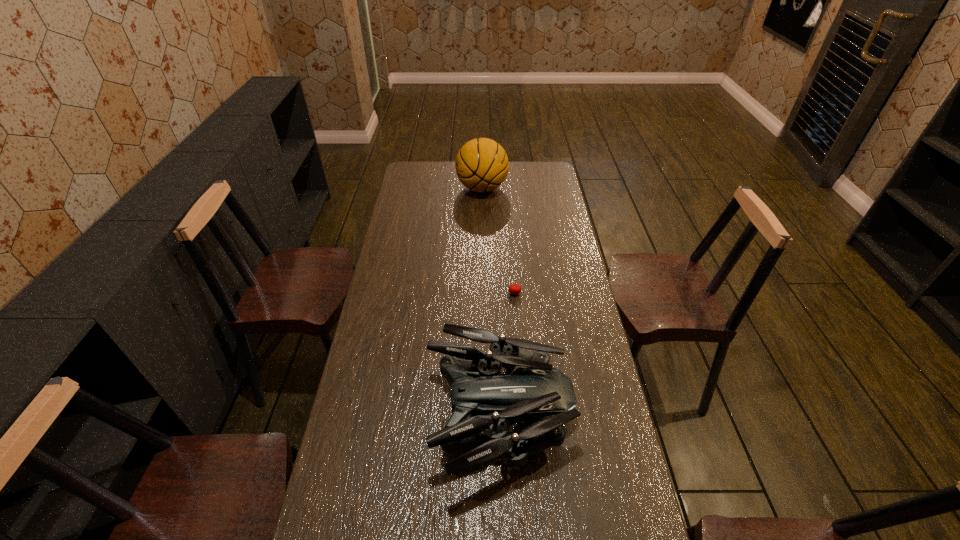
I want to click on vacant region between the drone and the farthest object, so click(x=491, y=302).

Find the location of `unoccupied position between the basketball and the second shortest object`. unoccupied position between the basketball and the second shortest object is located at coordinates (491, 302).

Locate an element on the screen. Image resolution: width=960 pixels, height=540 pixels. vacant space in between the second shortest object and the farthest object is located at coordinates (491, 302).

Locate an element on the screen. vacant area that lies between the farthest object and the cherry is located at coordinates (498, 241).

I want to click on free space between the farthest object and the cherry, so click(498, 241).

Point out which object is positioned as the second nearest to the basketball. Please provide its 2D coordinates. Your answer should be formatted as a tuple, i.e. [(x, y)], where the tuple contains the x and y coordinates of a point satisfying the conditions above.

[(482, 399)]

Where is `object identified as the second closest to the cherry`? This screenshot has height=540, width=960. object identified as the second closest to the cherry is located at coordinates (481, 164).

Locate an element on the screen. Image resolution: width=960 pixels, height=540 pixels. vacant space that satisfies the following two spatial constraints: 1. on the surface of the basketball near the brand logo; 2. on the left side of the second nearest object is located at coordinates (483, 293).

Find the location of a particular element. The height and width of the screenshot is (540, 960). vacant area that satisfies the following two spatial constraints: 1. on the surface of the drone near the brand logo; 2. on the right side of the tallest object is located at coordinates (484, 416).

I want to click on vacant area in the image that satisfies the following two spatial constraints: 1. on the surface of the nearest object near the brand logo; 2. on the right side of the farthest object, so click(484, 416).